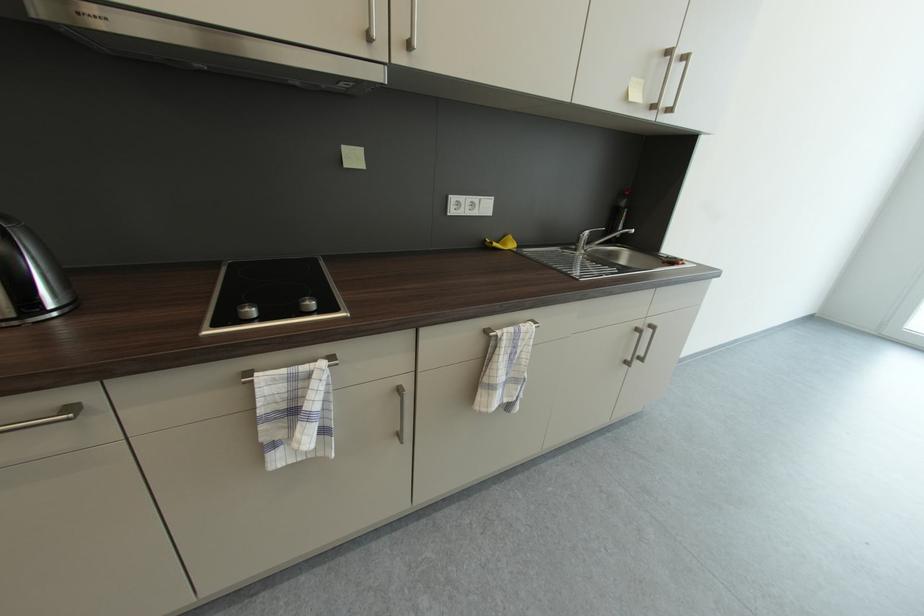
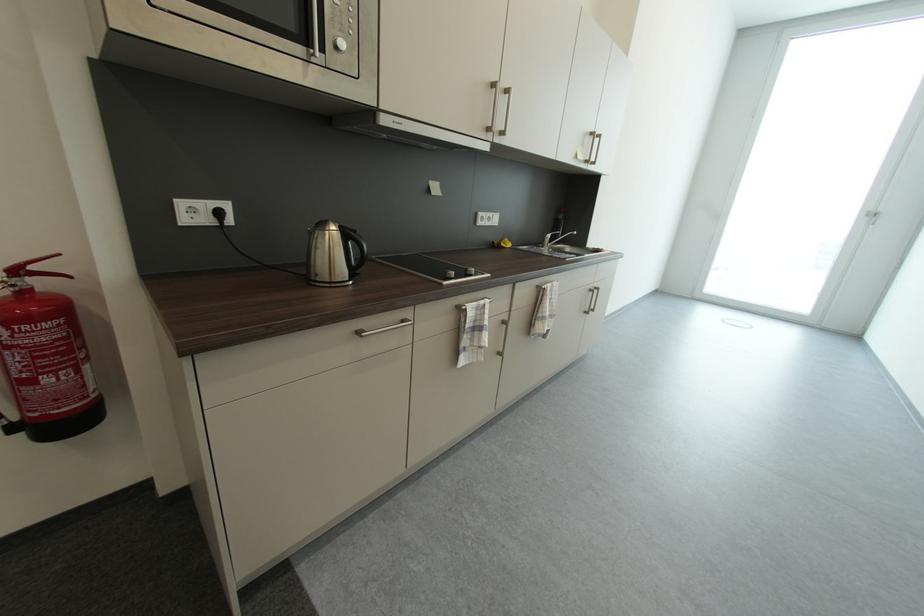
The point at (643,331) is marked in the first image. Where is the corresponding point in the second image?

(598, 292)